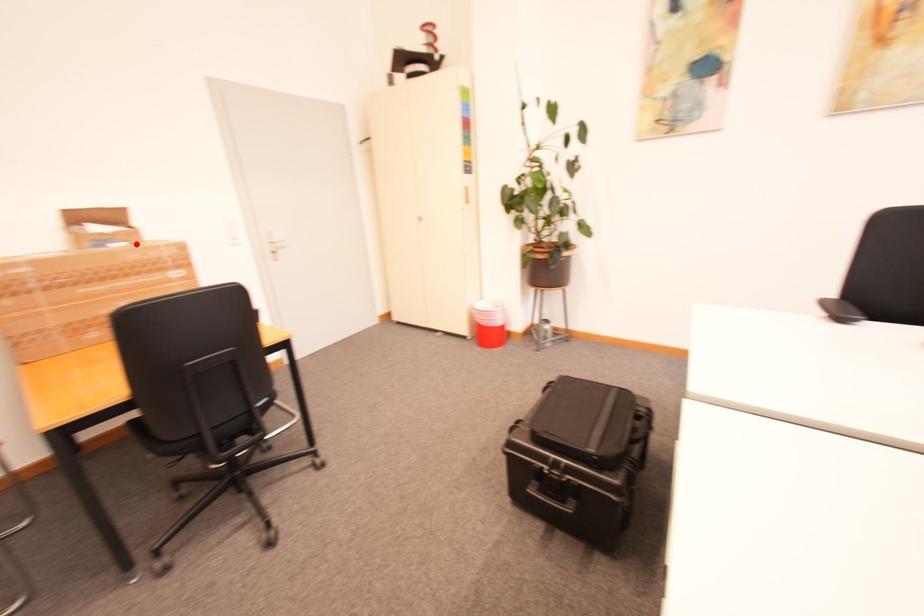
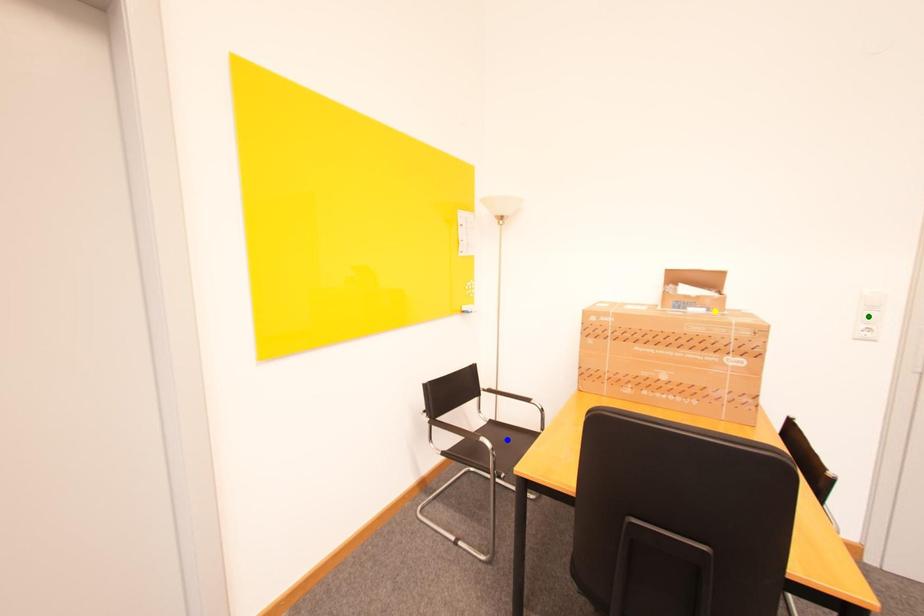
Question: I am providing you with two images of the same scene from different viewpoints. A red point is marked on the first image. You are given multiple points on the second image. In image 2, which mark is for the same physical point as the one in image 1?

Choices:
 (A) blue point
 (B) green point
 (C) yellow point

Answer: (C)